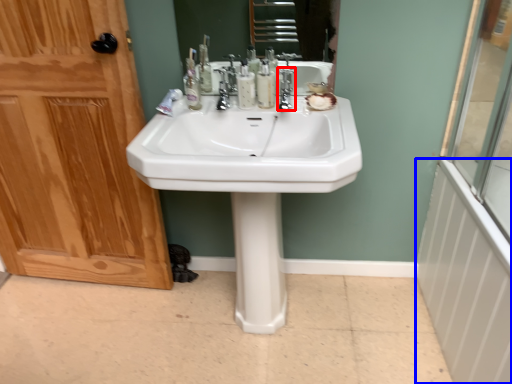
Question: Which of the following is the closest to the observer, faucet (highlighted by a red box) or radiator (highlighted by a blue box)?

Choices:
 (A) faucet
 (B) radiator

Answer: (B)